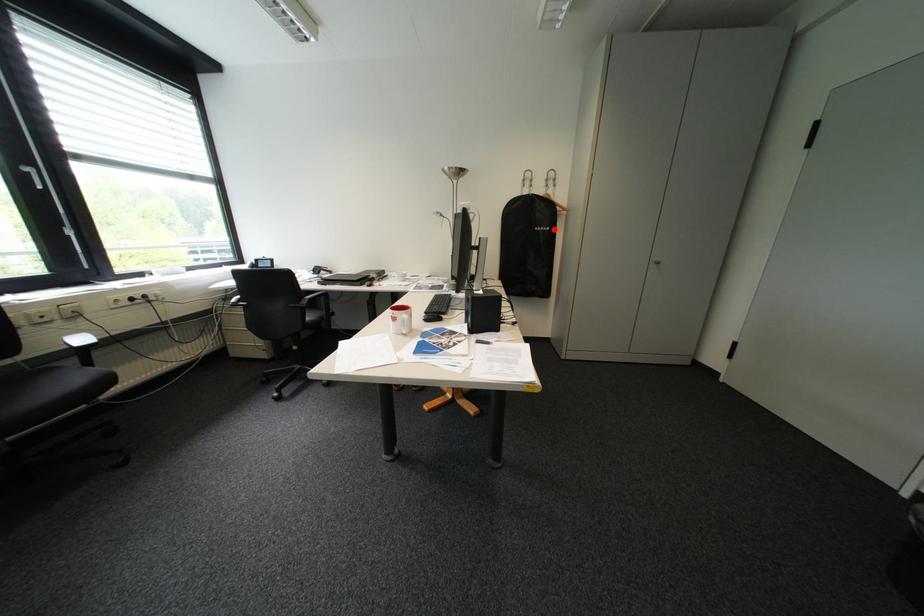
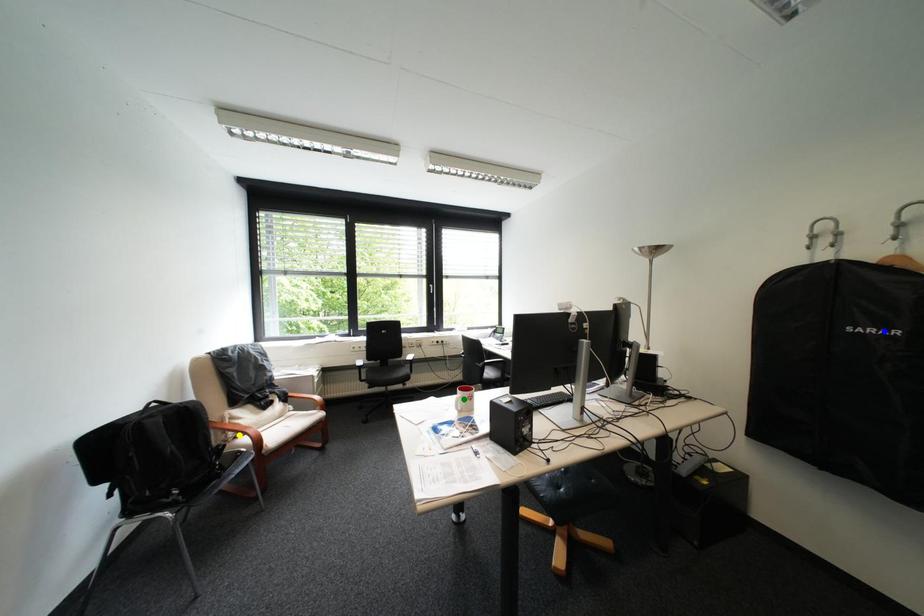
Question: I am providing you with two images of the same scene from different viewpoints. A red point is marked on the first image. You are given multiple points on the second image. Which point in image 2 represents the same 3d spot as the red point in image 1?

Choices:
 (A) yellow point
 (B) green point
 (C) blue point

Answer: (C)